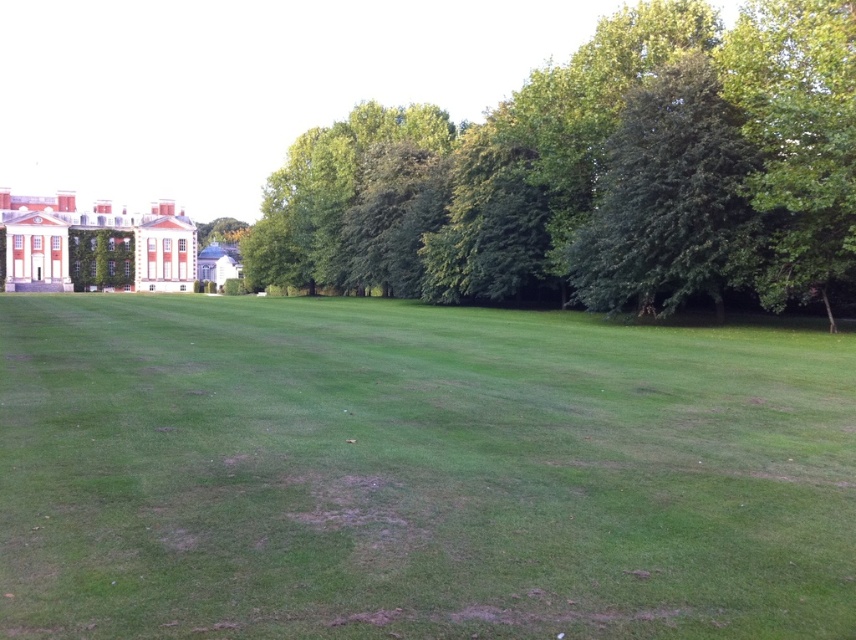
Question: Which point is closer to the camera?

Choices:
 (A) green grassy field at center
 (B) green ivy-covered wall at left
 (C) green leafy tree at center

Answer: (A)

Question: Is green leafy tree at center smaller than green ivy-covered wall at left?

Choices:
 (A) no
 (B) yes

Answer: (A)

Question: Is green leafy tree at center to the right of green ivy-covered wall at left from the viewer's perspective?

Choices:
 (A) no
 (B) yes

Answer: (B)

Question: Which point is closer to the camera taking this photo?

Choices:
 (A) (45, 500)
 (B) (590, 296)

Answer: (A)

Question: Estimate the real-world distances between objects in this image. Which object is farther from the green ivy-covered wall at left?

Choices:
 (A) green leafy tree at center
 (B) green grassy field at center

Answer: (B)

Question: Is green grassy field at center further to camera compared to green ivy-covered wall at left?

Choices:
 (A) yes
 (B) no

Answer: (B)